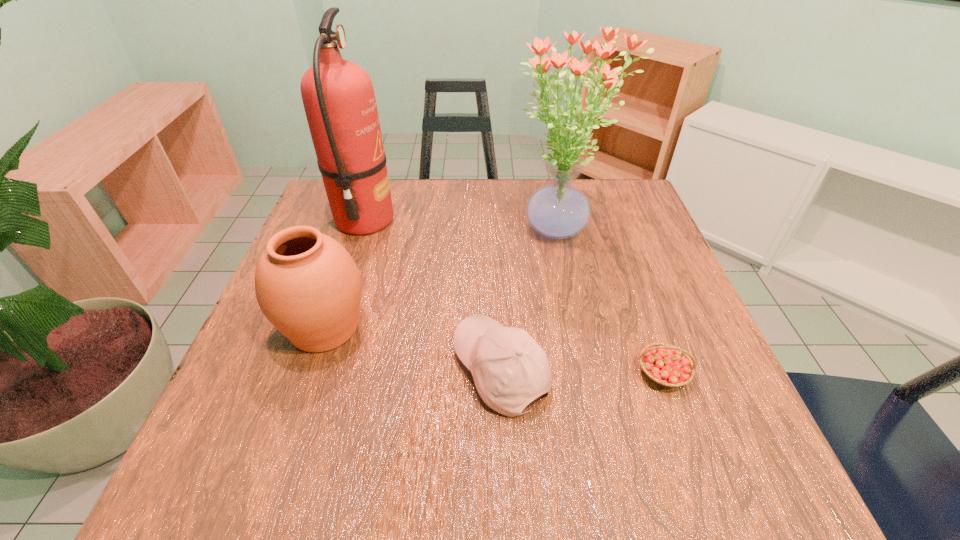
In the image, there is a desktop. Where is `vacant space at the far edge`? The image size is (960, 540). vacant space at the far edge is located at coordinates (399, 218).

Identify the location of free space at the near edge. (646, 484).

This screenshot has width=960, height=540. What are the coordinates of `vacant space at the right edge of the desktop` in the screenshot? It's located at (629, 311).

The height and width of the screenshot is (540, 960). I want to click on vacant space at the near right corner, so click(672, 459).

I want to click on empty space between the baseball cap and the flower arrangement, so click(529, 301).

The height and width of the screenshot is (540, 960). Find the location of `blank region between the fourth tallest object and the fire extinguisher`. blank region between the fourth tallest object and the fire extinguisher is located at coordinates (433, 295).

I want to click on free spot between the fire extinguisher and the strawberry, so click(x=514, y=296).

I want to click on vacant space in between the third shortest object and the second shortest object, so click(x=413, y=349).

Where is `vacant area between the urn and the baseball cap`? The width and height of the screenshot is (960, 540). vacant area between the urn and the baseball cap is located at coordinates (413, 349).

Identify the location of free space between the flower arrangement and the fourth tallest object. (529, 301).